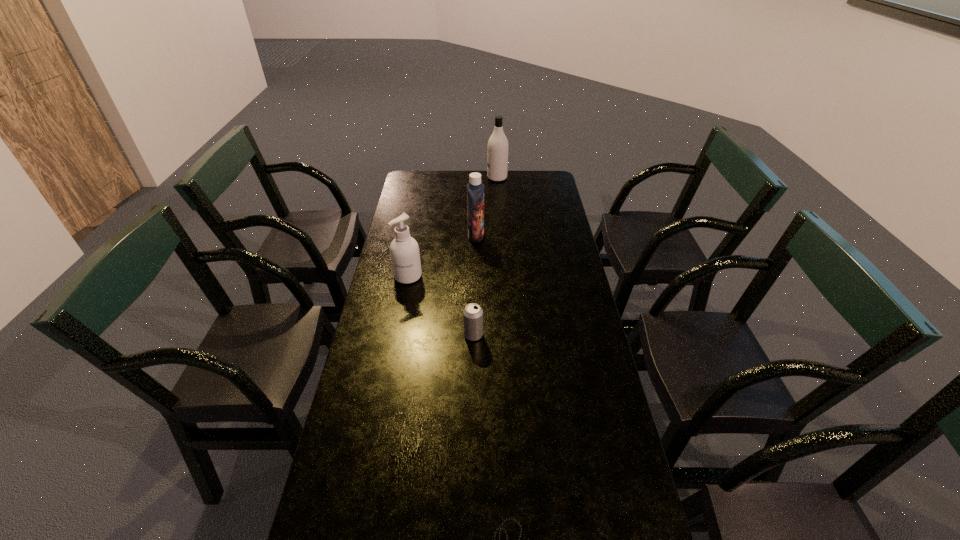
This screenshot has width=960, height=540. Identify the location of the right shampoo. (497, 150).

Locate an element on the screen. The height and width of the screenshot is (540, 960). the farthest object is located at coordinates (497, 150).

Identify the location of the left shampoo. (475, 189).

The width and height of the screenshot is (960, 540). I want to click on the nearer shampoo, so click(475, 189).

This screenshot has width=960, height=540. What are the coordinates of `the third nearest object` in the screenshot? It's located at (404, 251).

You are a GUI agent. You are given a task and a screenshot of the screen. Output one action in this format:
    pyautogui.click(x=<x>, y=<y>)
    Task: Click on the cleansing agent
    Image resolution: width=960 pixels, height=540 pixels.
    Given the screenshot: What is the action you would take?
    pyautogui.click(x=404, y=251)

Identify the location of the second shortest object. Image resolution: width=960 pixels, height=540 pixels. (472, 314).

You are a GUI agent. You are given a task and a screenshot of the screen. Output one action in this format:
    pyautogui.click(x=<x>, y=<y>)
    Task: Click on the second nearest object
    
    Given the screenshot: What is the action you would take?
    pyautogui.click(x=472, y=314)

The width and height of the screenshot is (960, 540). I want to click on blank area located 0.330m on the front-facing side of the right shampoo, so click(420, 178).

In order to click on vacant space situated on the front-facing side of the right shampoo in this screenshot , I will do `click(475, 178)`.